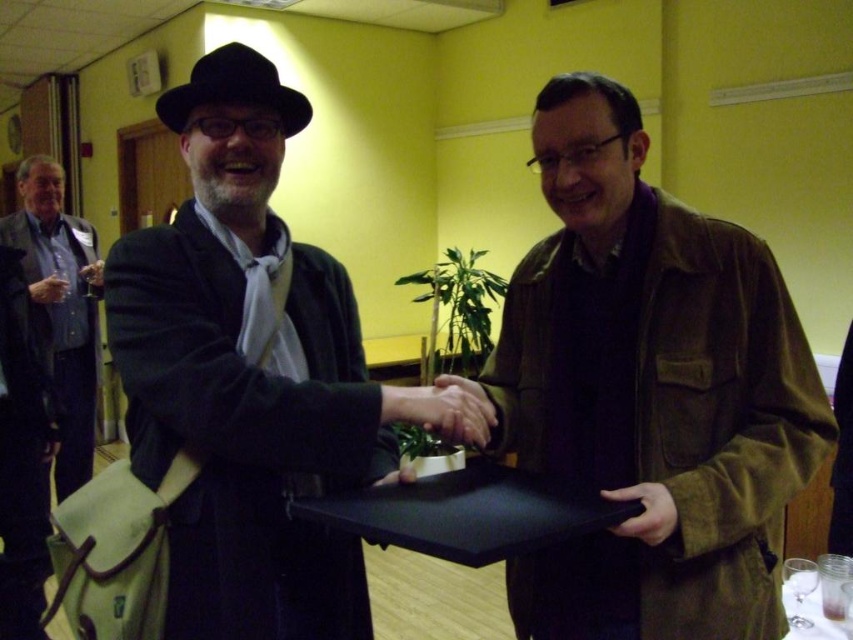
Who is higher up, black matte coat at center or brushed metal tie at left?

Positioned higher is brushed metal tie at left.

Is black matte coat at center below brushed metal tie at left?

Yes, black matte coat at center is below brushed metal tie at left.

At what (x,y) coordinates should I click in order to perform the action: click on black matte coat at center. Please return your answer as a coordinate pair (x, y). This screenshot has height=640, width=853. Looking at the image, I should click on coord(252,376).

The image size is (853, 640). In order to click on black matte coat at center in this screenshot , I will do `click(252, 376)`.

Image resolution: width=853 pixels, height=640 pixels. What do you see at coordinates (473, 397) in the screenshot? I see `matte black hand at center` at bounding box center [473, 397].

Is matte black hand at center below brown leather hand at center?

Yes, matte black hand at center is below brown leather hand at center.

Which is behind, point (486, 422) or point (49, 276)?

The point (49, 276) is behind.

The height and width of the screenshot is (640, 853). I want to click on matte black hand at center, so click(x=473, y=397).

Is point (668, 440) behind point (219, 356)?

That is True.

Between brown suede jacket at center and black matte coat at center, which one appears on the left side from the viewer's perspective?

Positioned to the left is black matte coat at center.

Which is behind, point (621, 144) or point (285, 410)?

Point (621, 144)

In order to click on brown suede jacket at center in this screenshot , I will do `click(648, 388)`.